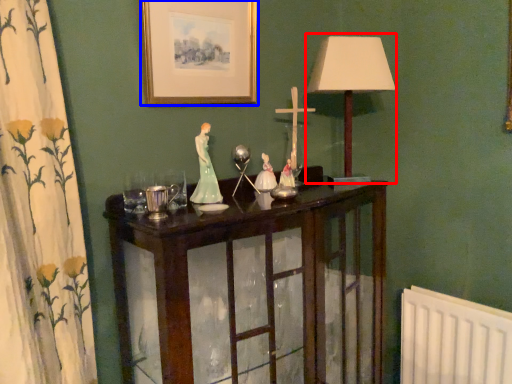
Question: Which point is closer to the camera, table lamp (highlighted by a red box) or picture frame (highlighted by a blue box)?

Choices:
 (A) table lamp
 (B) picture frame

Answer: (B)